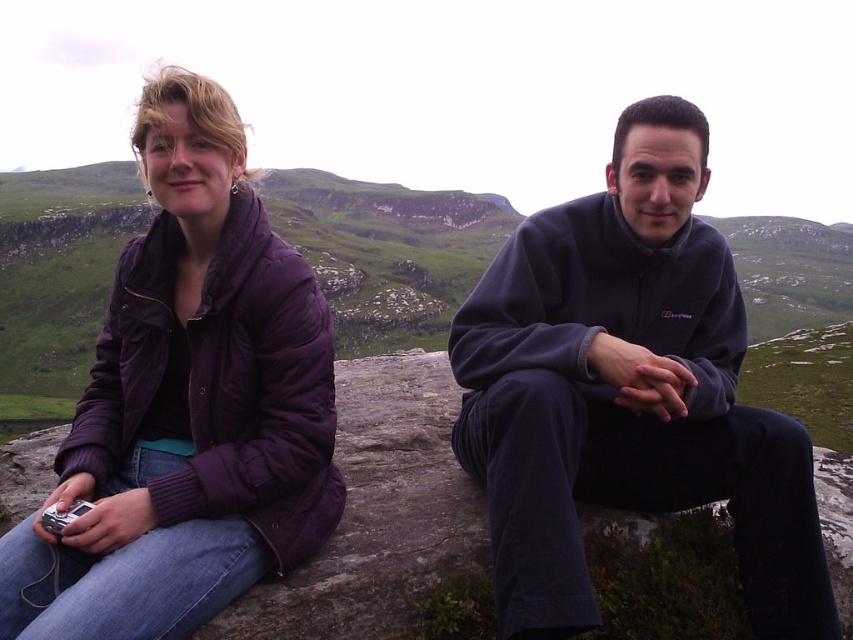
In the scene shown: You are a hiker who wants to take a photo of the dark gray fleece at center and the purple puffy jacket at left. Which one should you zoom in on to capture more details?

The dark gray fleece at center is larger in size than the purple puffy jacket at left, so you should zoom in on the purple puffy jacket at left to capture more details.

You are a photographer trying to capture a candid shot of the two people in the scene. You want to ensure that the dark gray fleece at center and the purple puffy jacket at left are both visible in the frame. Based on their positions, which object is closer to the camera, making it easier to focus on?

The dark gray fleece at center is positioned under the purple puffy jacket at left, meaning the purple puffy jacket at left is closer to the camera. Therefore, it would be easier to focus on the purple puffy jacket at left first.